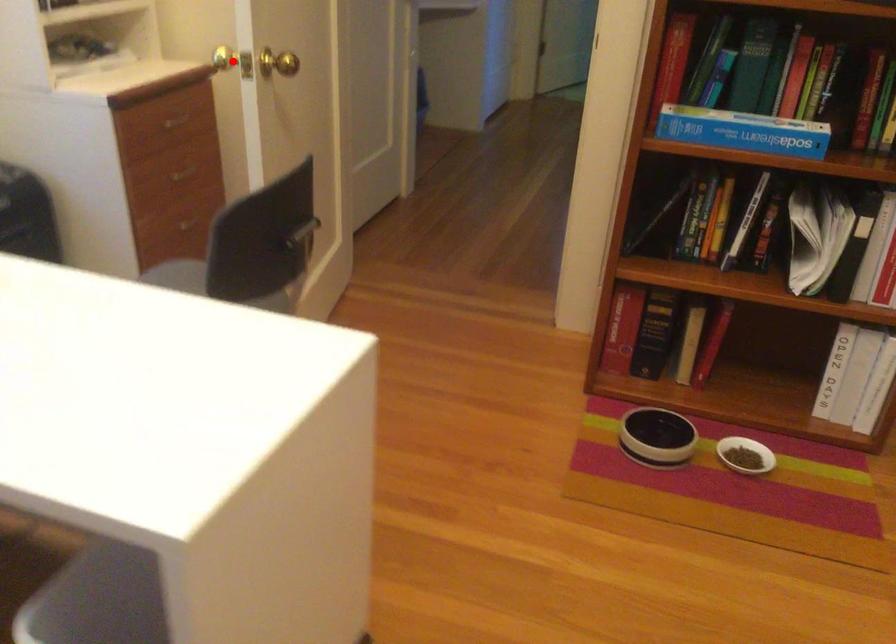
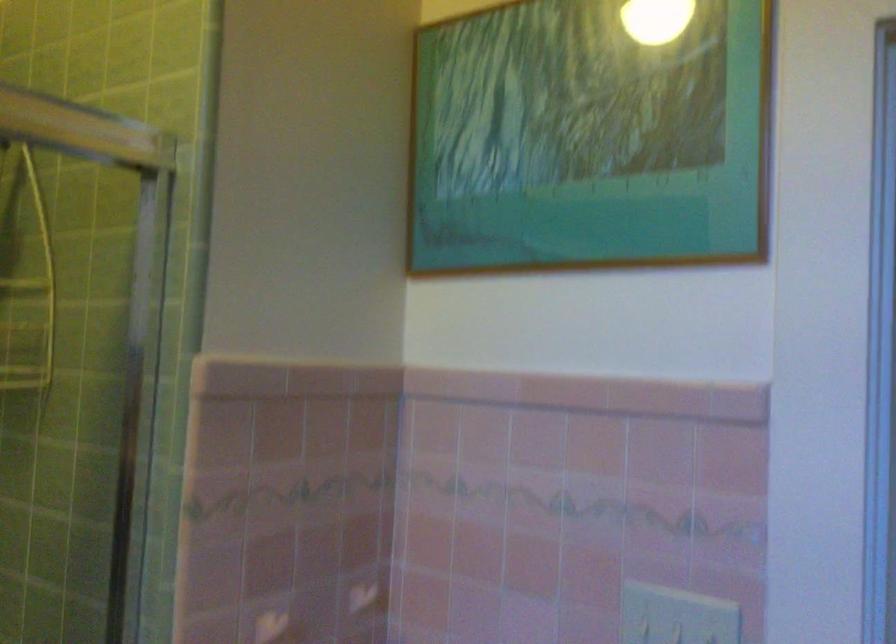
Question: I am providing you with two images of the same scene from different viewpoints. A red point is marked on the first image. At the location where the point appears in image 1, is it still visible in image 2?

Choices:
 (A) Yes
 (B) No

Answer: (B)